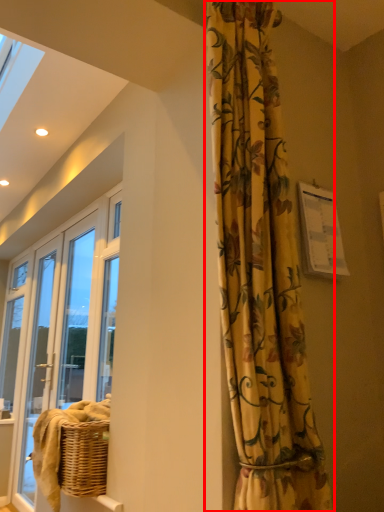
Question: Considering the relative positions of curtain (annotated by the red box) and screen door in the image provided, where is curtain (annotated by the red box) located with respect to the staircase?

Choices:
 (A) left
 (B) right

Answer: (B)